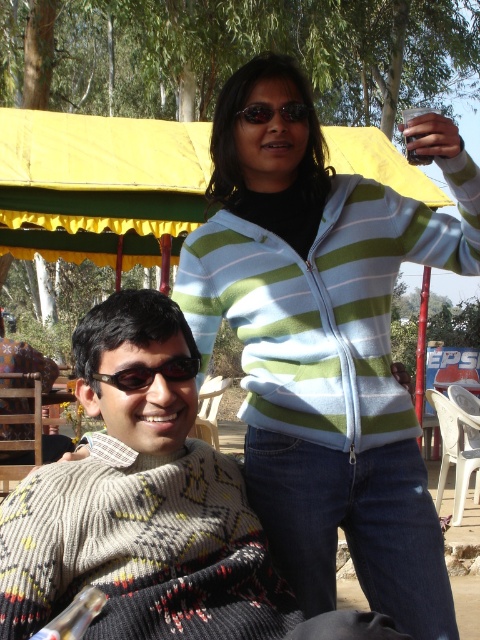
Question: Is the position of striped sweater at upper right less distant than that of translucent plastic bottle at lower left?

Choices:
 (A) yes
 (B) no

Answer: (B)

Question: Which object is the farthest from the black rubber goggles at left?

Choices:
 (A) knitted sweater at center
 (B) translucent plastic bottle at lower left
 (C) metallic silver cup at upper right
 (D) sunglasses at upper center

Answer: (C)

Question: Can you confirm if striped sweater at upper right is thinner than translucent plastic bottle at lower left?

Choices:
 (A) yes
 (B) no

Answer: (B)

Question: Can you confirm if striped sweater at upper right is positioned to the right of black rubber goggles at left?

Choices:
 (A) yes
 (B) no

Answer: (A)

Question: Which object is positioned farthest from the metallic silver cup at upper right?

Choices:
 (A) sunglasses at upper center
 (B) black rubber goggles at left
 (C) knitted sweater at center
 (D) striped sweater at upper right

Answer: (C)

Question: Which of the following is the closest to the observer?

Choices:
 (A) metallic silver cup at upper right
 (B) black rubber goggles at left
 (C) sunglasses at upper center

Answer: (B)